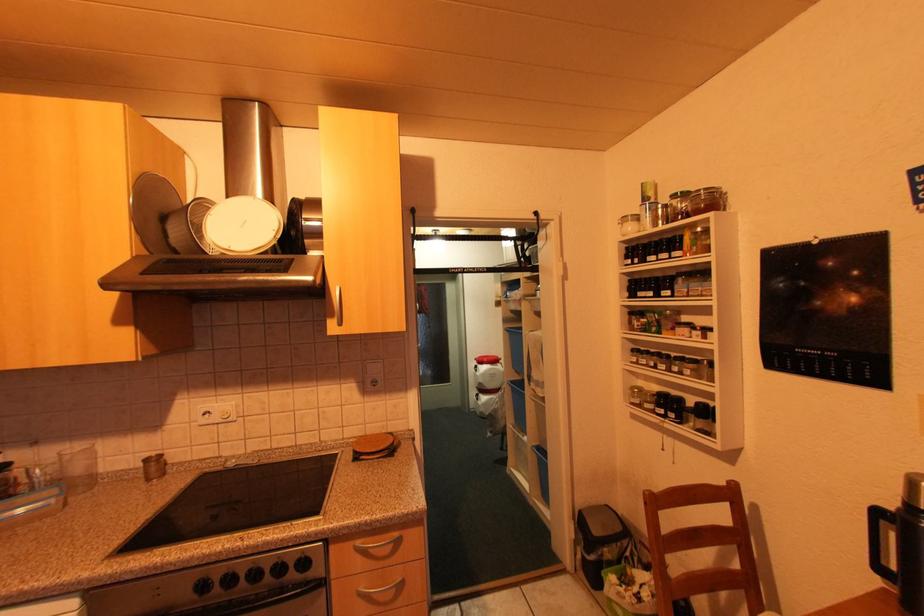
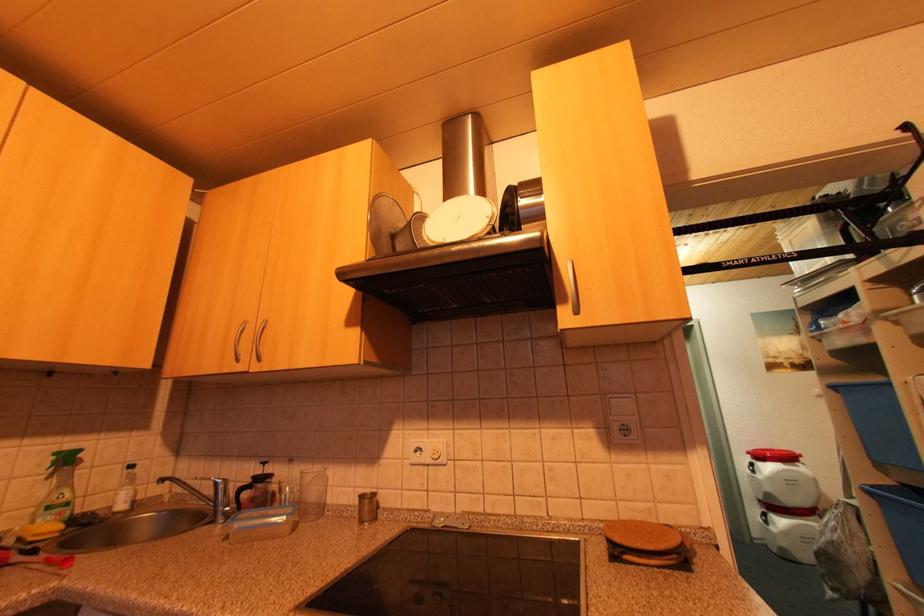
How did the camera likely rotate?

The camera rotated toward left-up.